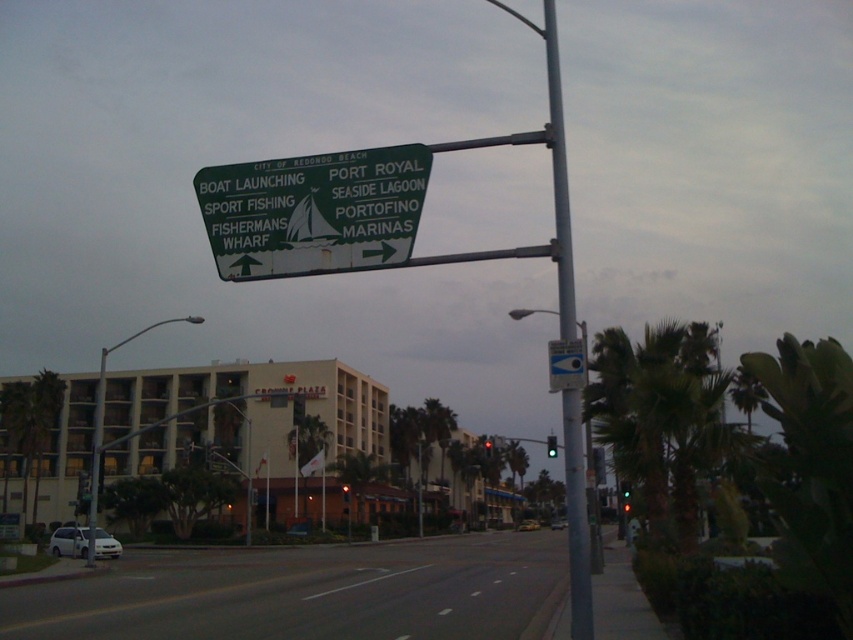
Looking at this image, does silver metallic pole at center appear over green glass traffic light at upper center?

Correct, silver metallic pole at center is located above green glass traffic light at upper center.

What do you see at coordinates (560, 179) in the screenshot? I see `silver metallic pole at center` at bounding box center [560, 179].

Locate an element on the screen. The image size is (853, 640). silver metallic pole at center is located at coordinates 560,179.

Which of these two, yellow metallic taxi cab at center or white matte car at center, stands shorter?

Standing shorter between the two is yellow metallic taxi cab at center.

Is point (521, 531) in front of point (561, 524)?

Yes, point (521, 531) is in front of point (561, 524).

Which is in front, point (532, 520) or point (560, 522)?

Point (532, 520) is in front.

Image resolution: width=853 pixels, height=640 pixels. In order to click on yellow metallic taxi cab at center in this screenshot , I will do `click(527, 524)`.

Consider the image. Does green leafy palm tree at center have a lesser height compared to white plastic parking sign at upper center?

Correct, green leafy palm tree at center is not as tall as white plastic parking sign at upper center.

Is point (352, 486) farther from camera compared to point (569, 365)?

Yes, it is.

Where is `green leafy palm tree at center`? The width and height of the screenshot is (853, 640). green leafy palm tree at center is located at coordinates (358, 481).